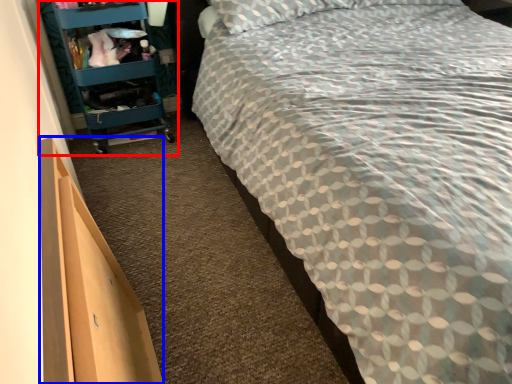
Question: Which object is further to the camera taking this photo, furniture (highlighted by a red box) or drawer (highlighted by a blue box)?

Choices:
 (A) furniture
 (B) drawer

Answer: (A)